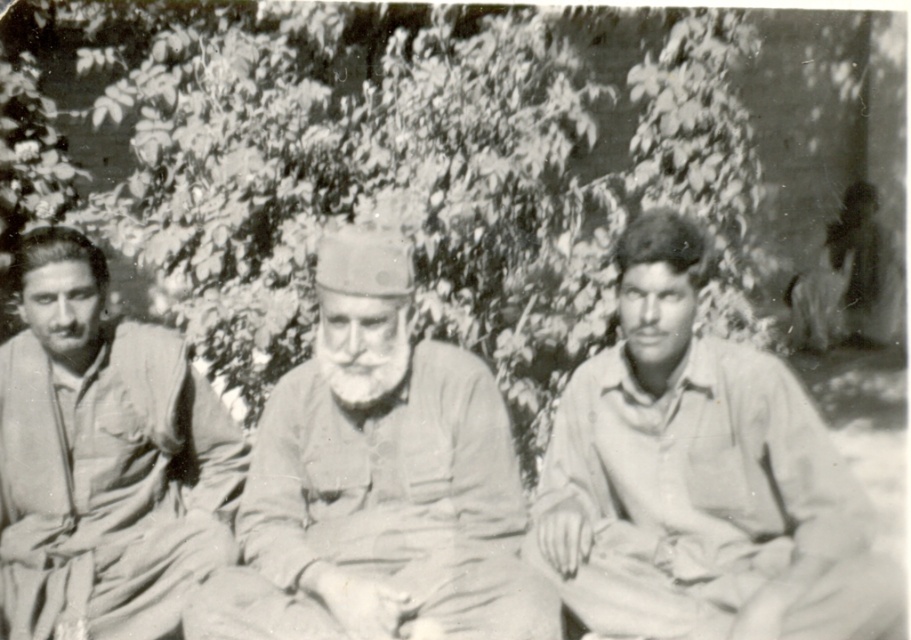
Question: Which is nearer to the light gray fabric cap at center?

Choices:
 (A) matte khaki uniform at center
 (B) light gray shirt at center

Answer: (B)

Question: Can you confirm if light gray fabric cap at center is bigger than matte khaki uniform at center?

Choices:
 (A) no
 (B) yes

Answer: (A)

Question: Where is light gray fabric cap at center located in relation to matte khaki uniform at center in the image?

Choices:
 (A) right
 (B) left

Answer: (A)

Question: From the image, what is the correct spatial relationship of light gray shirt at center in relation to light gray fabric cap at center?

Choices:
 (A) below
 (B) above

Answer: (A)

Question: Which of the following is the farthest from the observer?

Choices:
 (A) (363, 301)
 (B) (103, 332)

Answer: (B)

Question: Based on their relative distances, which object is nearer to the light gray shirt at center?

Choices:
 (A) light gray fabric cap at center
 (B) matte khaki uniform at center

Answer: (A)